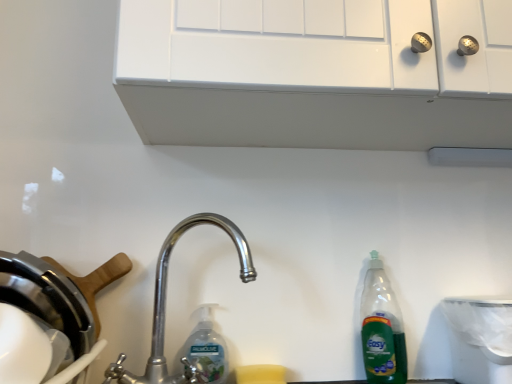
Question: Is polished metal faucet at center next to white plastic trash can at lower right and touching it?

Choices:
 (A) yes
 (B) no

Answer: (B)

Question: Could you tell me if polished metal faucet at center is turned towards white plastic trash can at lower right?

Choices:
 (A) no
 (B) yes

Answer: (A)

Question: From the image's perspective, is polished metal faucet at center beneath white plastic trash can at lower right?

Choices:
 (A) yes
 (B) no

Answer: (B)

Question: Is polished metal faucet at center further to camera compared to white plastic trash can at lower right?

Choices:
 (A) no
 (B) yes

Answer: (A)

Question: Is polished metal faucet at center closer to the viewer compared to white plastic trash can at lower right?

Choices:
 (A) yes
 (B) no

Answer: (A)

Question: Considering their positions, is white plastic trash can at lower right located in front of or behind clear plastic bottle at center?

Choices:
 (A) behind
 (B) front

Answer: (B)

Question: Based on their sizes in the image, would you say white plastic trash can at lower right is bigger or smaller than clear plastic bottle at center?

Choices:
 (A) small
 (B) big

Answer: (B)

Question: Which is correct: white plastic trash can at lower right is inside clear plastic bottle at center, or outside of it?

Choices:
 (A) inside
 (B) outside

Answer: (B)

Question: Is point (456, 317) positioned closer to the camera than point (201, 329)?

Choices:
 (A) closer
 (B) farther

Answer: (A)

Question: Is clear plastic bottle at center inside the boundaries of white matte cabinet at upper center, or outside?

Choices:
 (A) inside
 (B) outside

Answer: (B)

Question: Is clear plastic bottle at center taller or shorter than white matte cabinet at upper center?

Choices:
 (A) short
 (B) tall

Answer: (A)

Question: Considering the positions of clear plastic bottle at center and white matte cabinet at upper center in the image, is clear plastic bottle at center bigger or smaller than white matte cabinet at upper center?

Choices:
 (A) small
 (B) big

Answer: (A)

Question: From a real-world perspective, is clear plastic bottle at center physically located above or below white matte cabinet at upper center?

Choices:
 (A) below
 (B) above

Answer: (A)

Question: From a real-world perspective, is polished metal faucet at center above or below white matte cabinet at upper center?

Choices:
 (A) above
 (B) below

Answer: (B)

Question: Considering the positions of point (130, 379) and point (136, 86), is point (130, 379) closer or farther from the camera than point (136, 86)?

Choices:
 (A) farther
 (B) closer

Answer: (A)